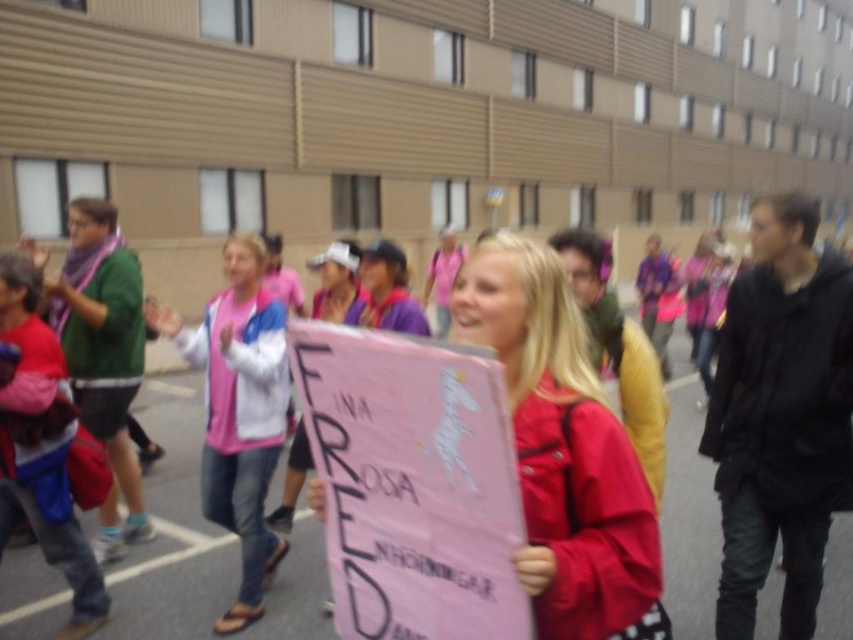
You are a pedestrian walking down the street and see both the pink paper sign at center and the matte pink sign at center. Which one is positioned lower?

The pink paper sign at center is positioned lower than the matte pink sign at center, as it is described as being below it.

You are an event organizer who needs to ensure that the pink paper sign at center is visible to attendees standing behind the woman. Given that the pink fabric jacket at center is wider than the sign, will the sign be fully visible to those behind her?

The pink paper sign at center is narrower than the pink fabric jacket at center, so part of the sign might be obscured by the jacket, making it less visible to attendees behind the woman.

You are a photographer trying to capture both the pink paper sign at center and the matte pink sign at center in a single shot. Given their sizes, which one would you need to position closer to the camera to ensure both are clearly visible?

Since the pink paper sign at center occupies less space than the matte pink sign at center, you should position the smaller pink paper sign at center closer to the camera to balance their sizes in the frame.